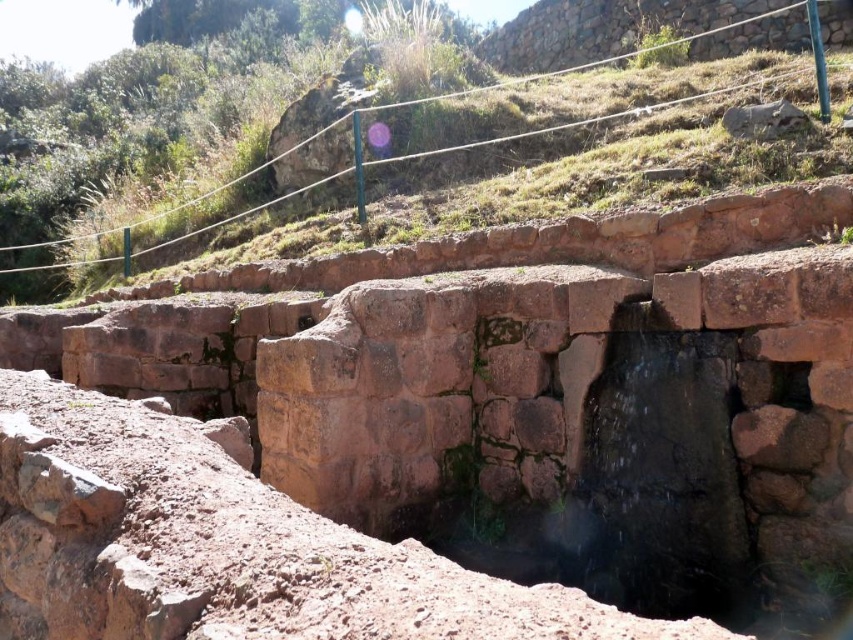
You are an archaeologist examining the ancient stone structure. You notice two features at the center of the structure. One is the brown rough stone at center and the other is the brown stone steps at center. Which of these two is smaller in size?

The brown rough stone at center is smaller than the brown stone steps at center according to the description provided.

You are standing at the bottom of the sloped area and want to reach the brown rough stone at center. Which direction should you move to get there?

To reach the brown rough stone at center, you should move uphill along the sloped area since it is located at point (432, 428), which is higher in elevation compared to your starting position at the bottom.

You are standing at the bottom of the slope looking towards the ancient stone structure. You see the brown rough stone at center and the brown stone steps at center. Which object is closer to you?

The brown rough stone at center is closer to the viewer than the brown stone steps at center.